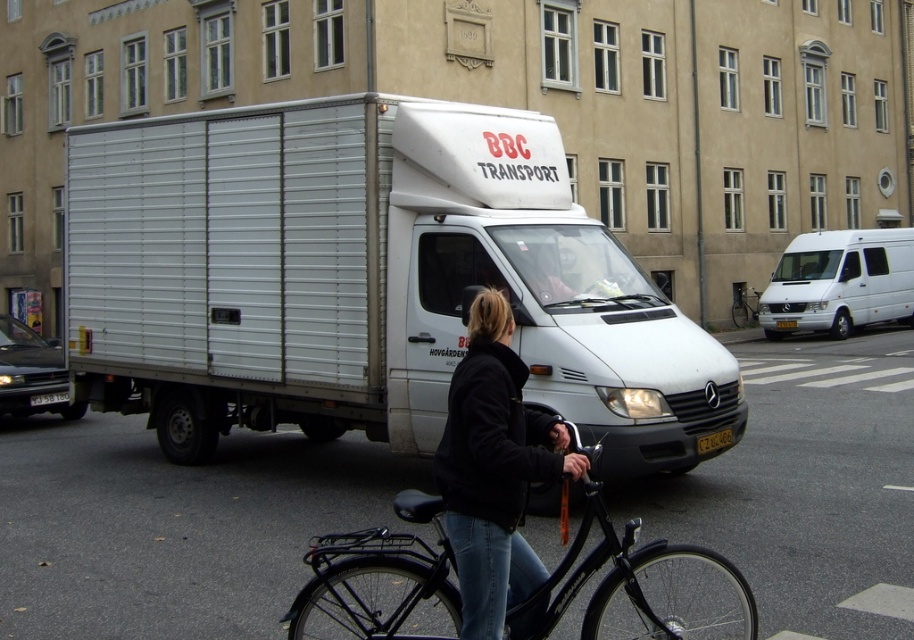
Question: Considering the real-world distances, which object is farthest from the white metallic truck at center?

Choices:
 (A) black matte bicycle at lower center
 (B) black matte bicycle at center

Answer: (B)

Question: Is white metallic truck at center above black matte bicycle at lower center?

Choices:
 (A) no
 (B) yes

Answer: (B)

Question: Among these objects, which one is farthest from the camera?

Choices:
 (A) white matte van at right
 (B) white metallic truck at center

Answer: (A)

Question: Can you confirm if white metallic truck at center is bigger than white matte van at right?

Choices:
 (A) no
 (B) yes

Answer: (B)

Question: Observing the image, what is the correct spatial positioning of black matte bicycle at lower center in reference to white matte van at right?

Choices:
 (A) below
 (B) above

Answer: (A)

Question: Which point is farther to the camera?

Choices:
 (A) black matte bicycle at center
 (B) white metallic truck at center
 (C) white matte van at right
 (D) black soft jacket at center

Answer: (A)